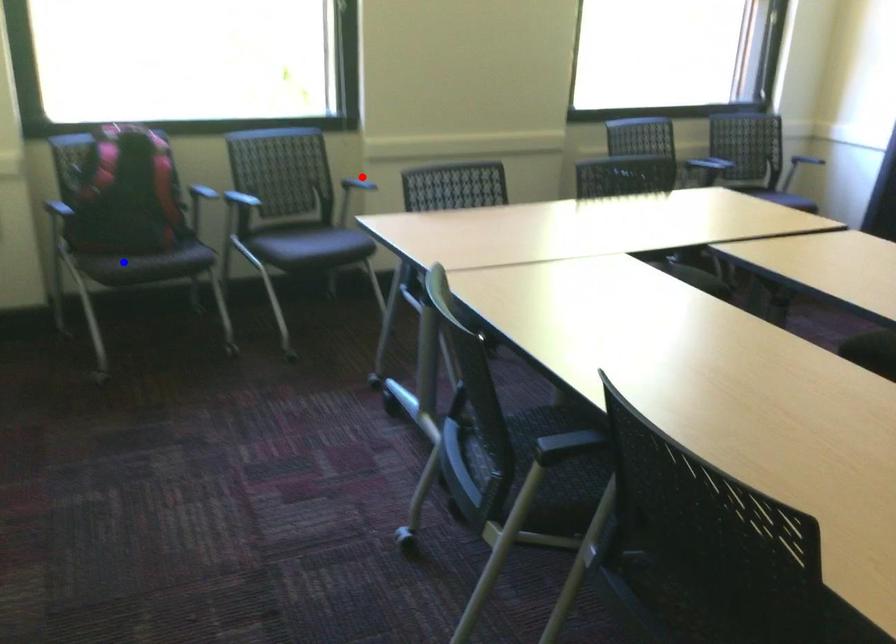
Question: In the image, two points are highlighted. Which point is nearer to the camera? Reply with the corresponding letter.

Choices:
 (A) blue point
 (B) red point

Answer: (A)